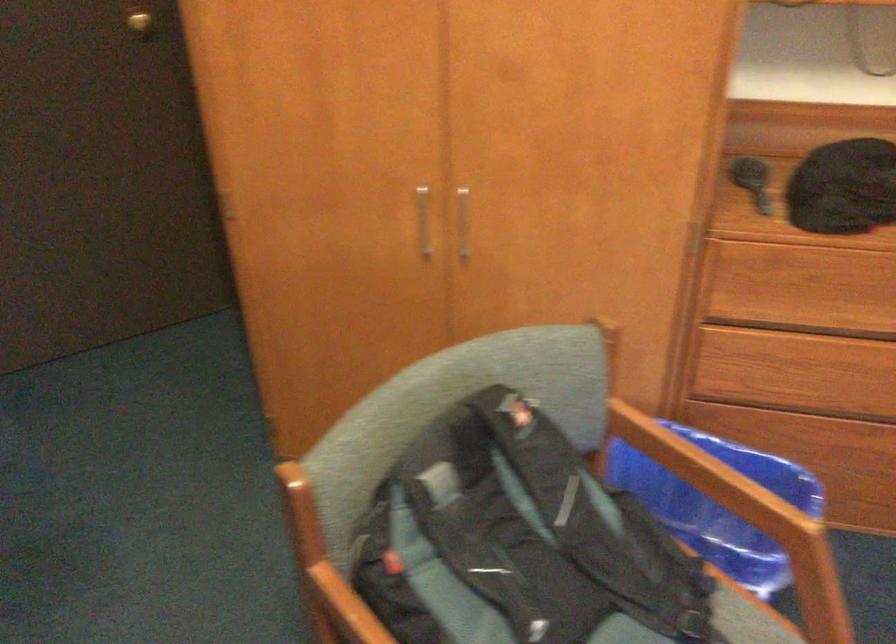
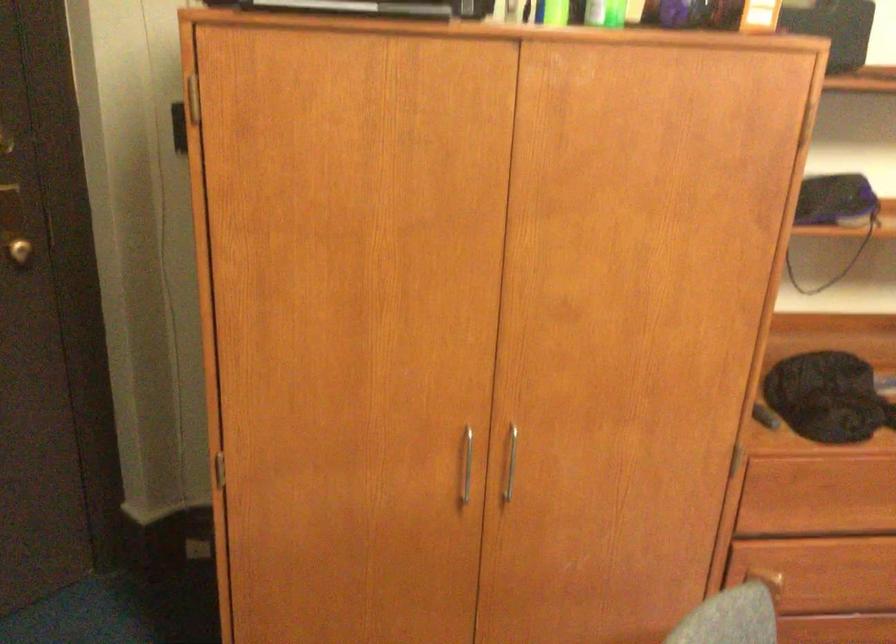
Question: The camera is either moving clockwise (left) or counter-clockwise (right) around the object. The first image is from the beginning of the video and the second image is from the end. Is the camera moving left or right when shooting the video?

Choices:
 (A) Left
 (B) Right

Answer: (A)